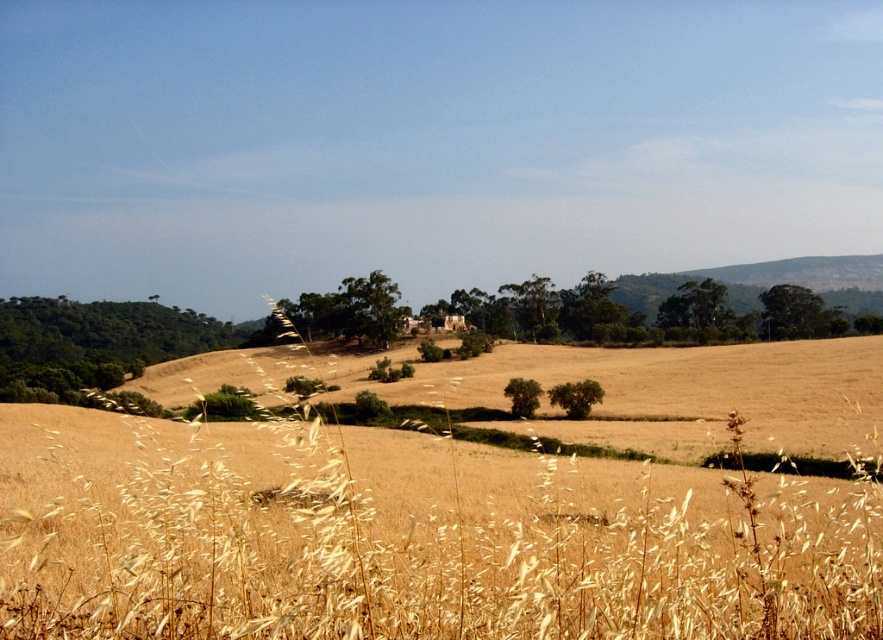
Question: From the image, what is the correct spatial relationship of golden dry grass at center in relation to green leafy tree at left?

Choices:
 (A) above
 (B) below

Answer: (B)

Question: Which object appears closest to the camera in this image?

Choices:
 (A) golden dry grass at center
 (B) green leafy tree at left

Answer: (A)

Question: Where is golden dry grass at center located in relation to green leafy tree at left in the image?

Choices:
 (A) above
 (B) below

Answer: (B)

Question: From the image, what is the correct spatial relationship of golden dry grass at center in relation to green leafy tree at left?

Choices:
 (A) right
 (B) left

Answer: (A)

Question: Among these objects, which one is farthest from the camera?

Choices:
 (A) green leafy tree at left
 (B) golden dry grass at center

Answer: (A)